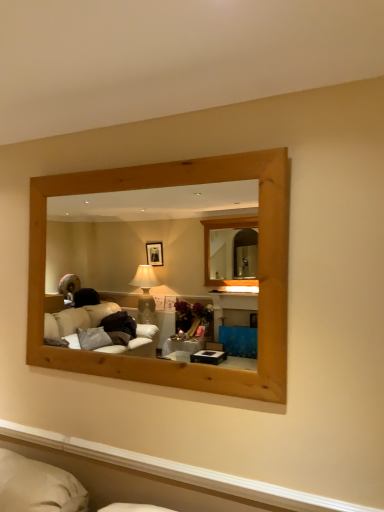
Where is `empty space that is ontop of natural wood mirror at upper center`? empty space that is ontop of natural wood mirror at upper center is located at coordinates (138, 164).